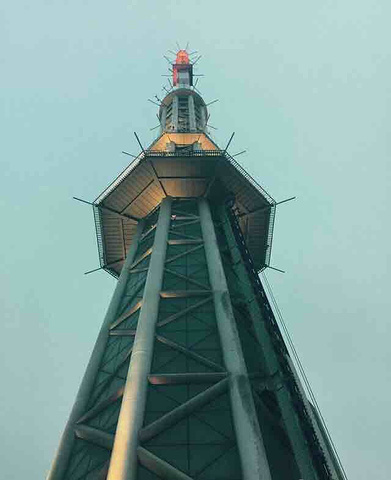
Where is `left pipe`? left pipe is located at coordinates (223, 306).